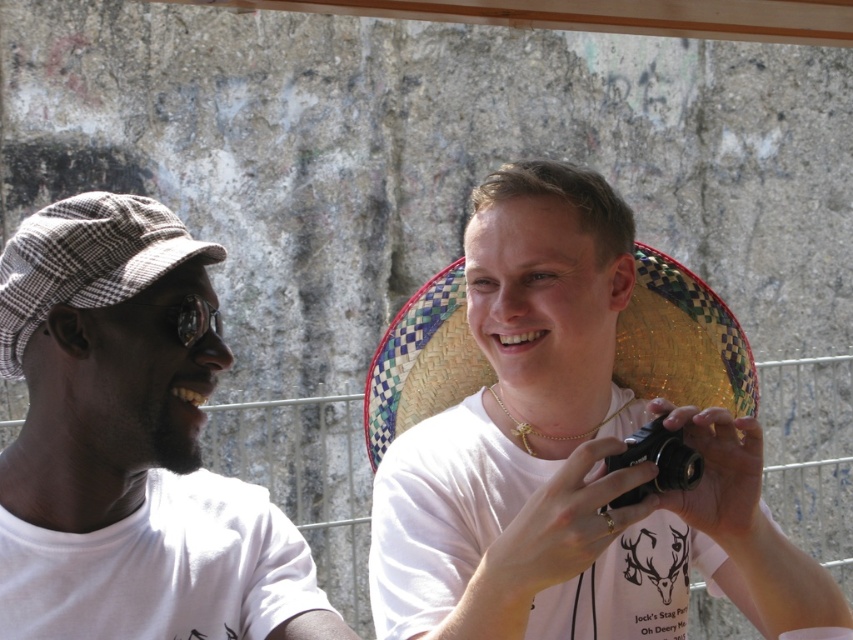
Question: Is white matte camera at center closer to the viewer compared to black plastic camera at center?

Choices:
 (A) no
 (B) yes

Answer: (B)

Question: Does woven straw sombrero at center lie in front of black plastic camera at center?

Choices:
 (A) no
 (B) yes

Answer: (A)

Question: Among these objects, which one is nearest to the camera?

Choices:
 (A) checkered fabric baseball cap at left
 (B) woven straw sombrero at center
 (C) white matte camera at center

Answer: (A)

Question: Among these points, which one is nearest to the camera?

Choices:
 (A) (86, 480)
 (B) (712, 308)
 (C) (494, 314)
 (D) (125, 291)

Answer: (D)

Question: Based on their relative distances, which object is nearer to the checkered fabric baseball cap at left?

Choices:
 (A) woven straw sombrero at center
 (B) white cotton shirt at left
 (C) white matte camera at center

Answer: (B)

Question: Is white matte camera at center above woven straw sombrero at center?

Choices:
 (A) no
 (B) yes

Answer: (A)